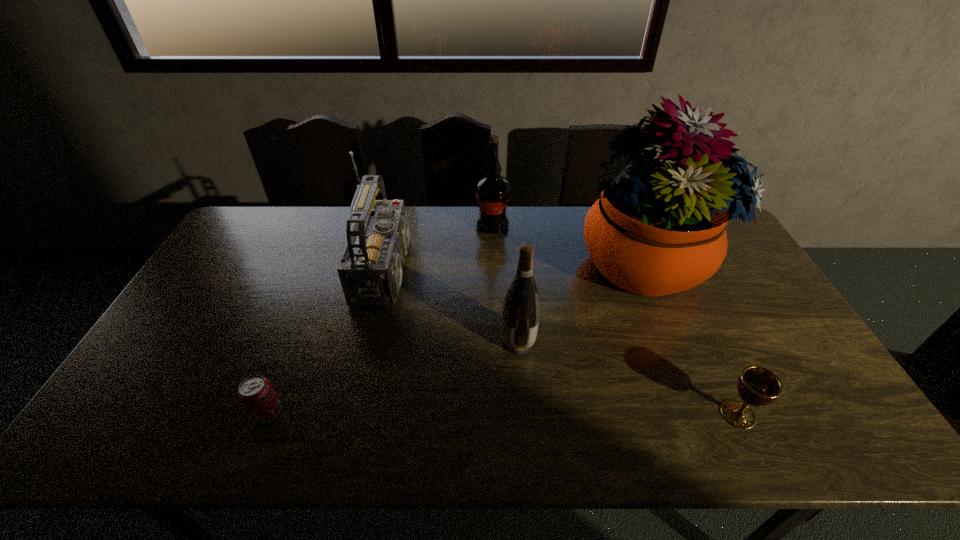
Locate an element on the screen. The height and width of the screenshot is (540, 960). free location that satisfies the following two spatial constraints: 1. on the front-facing side of the chalice; 2. on the left side of the radio receiver is located at coordinates (360, 414).

Identify the location of vacant space that satisfies the following two spatial constraints: 1. on the front side of the flower arrangement; 2. on the label of the fourth farthest object. click(673, 342).

At what (x,y) coordinates should I click in order to perform the action: click on free space that satisfies the following two spatial constraints: 1. on the front-facing side of the fifth tallest object; 2. on the left side of the second object from left to right. Please return your answer as a coordinate pair (x, y). Image resolution: width=960 pixels, height=540 pixels. Looking at the image, I should click on (360, 414).

Locate an element on the screen. The image size is (960, 540). free region that satisfies the following two spatial constraints: 1. on the front-facing side of the second object from left to right; 2. on the front side of the shortest object is located at coordinates (360, 413).

Find the location of `vacant space that satisfies the following two spatial constraints: 1. on the label of the chalice; 2. on the right side of the third nearest object`. vacant space that satisfies the following two spatial constraints: 1. on the label of the chalice; 2. on the right side of the third nearest object is located at coordinates (524, 414).